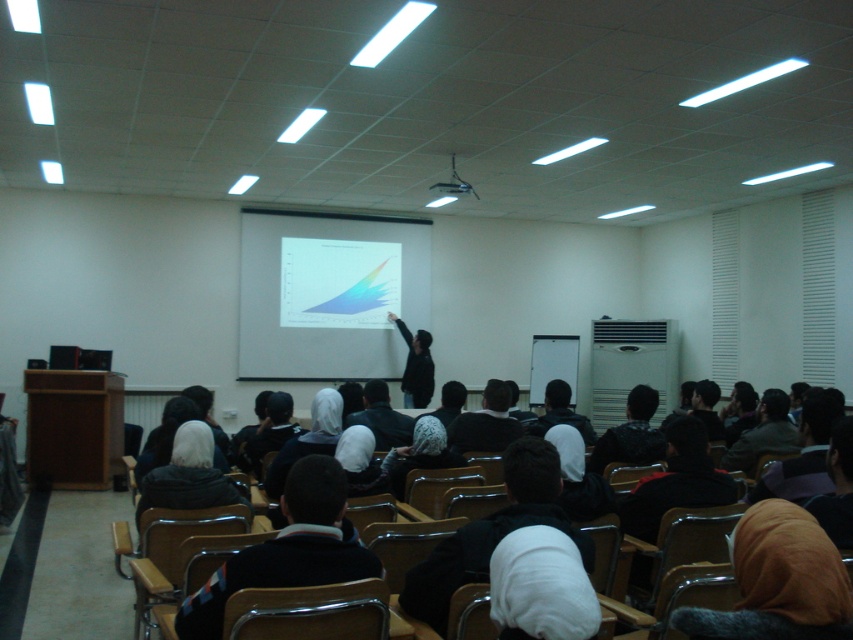
You are a student sitting in the back row of the classroom. You notice two items in the front of the room. One is the dark gray sweater at center and the other is the black plastic projector at upper center. Which one appears taller from your perspective?

The dark gray sweater at center appears taller than the black plastic projector at upper center because it has a greater height compared to it.

You are a student sitting in the classroom and want to hand a note to the person wearing the dark gray sweater at center. Based on their position, where should you look to find them?

The dark gray sweater at center is located at point 0.645 on the x and 0.658 on the y coordinates, so you should look towards the center area of the classroom to find them.

You are a student sitting in the back row of the classroom. You notice two items in the front of the room. Which one takes up more space visually between the dark gray sweater at center and the black plastic projector at upper center?

The dark gray sweater at center takes up more space visually because it is bigger than the black plastic projector at upper center.